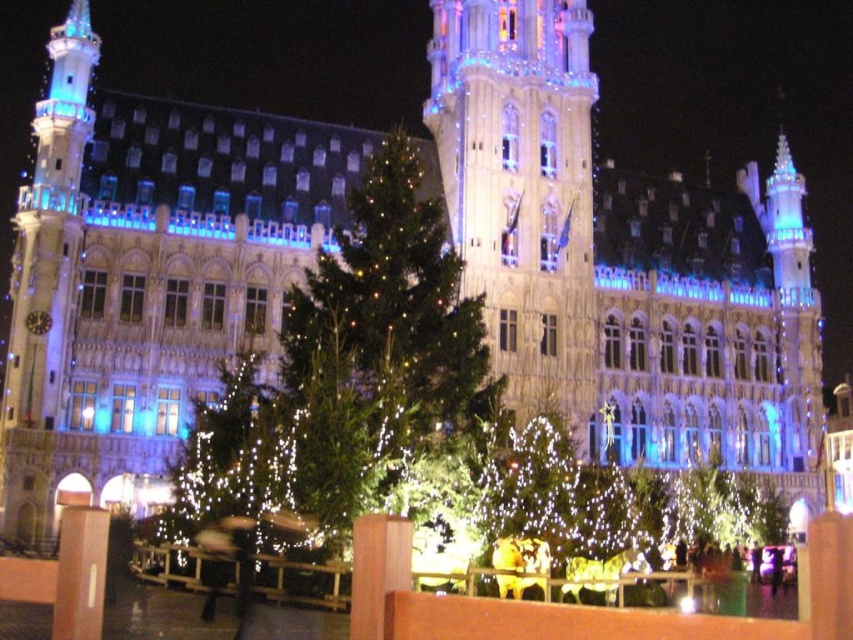
Does illuminated stone tower at center have a greater width compared to green matte tree at center?

Incorrect, illuminated stone tower at center's width does not surpass green matte tree at center's.

The height and width of the screenshot is (640, 853). Describe the element at coordinates (521, 188) in the screenshot. I see `illuminated stone tower at center` at that location.

This screenshot has width=853, height=640. In order to click on illuminated stone tower at center in this screenshot , I will do click(521, 188).